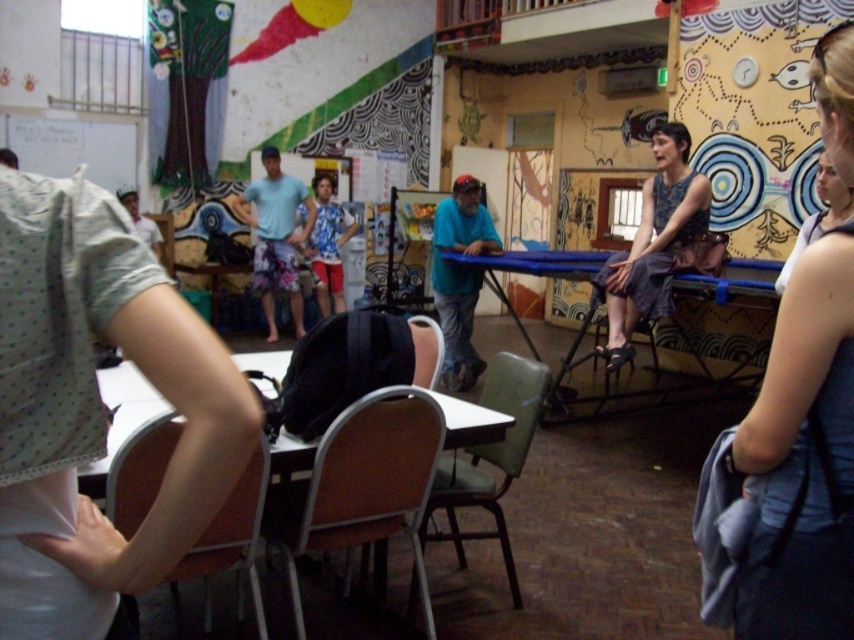
The width and height of the screenshot is (854, 640). What do you see at coordinates (276, 236) in the screenshot? I see `light blue t-shirt at center` at bounding box center [276, 236].

Does light blue t-shirt at center have a lesser height compared to brown leather chair at center?

In fact, light blue t-shirt at center may be taller than brown leather chair at center.

Is point (250, 227) closer to viewer compared to point (433, 362)?

That is False.

Identify the location of light blue t-shirt at center. This screenshot has width=854, height=640. (276, 236).

Is shiny blue dress at center positioned in front of green plastic chair at center?

No, shiny blue dress at center is further to the viewer.

Is point (671, 310) positioned after point (537, 394)?

Yes, it is behind point (537, 394).

Is point (648, 269) closer to camera compared to point (416, 595)?

That is False.

Find the location of a particular element. The image size is (854, 640). shiny blue dress at center is located at coordinates (652, 243).

Between shiny blue dress at center and brown wood table at center, which one has more height?

shiny blue dress at center

Which is in front, point (632, 291) or point (459, 410)?

Point (459, 410) is in front.

Identify the location of shiny blue dress at center. The height and width of the screenshot is (640, 854). 652,243.